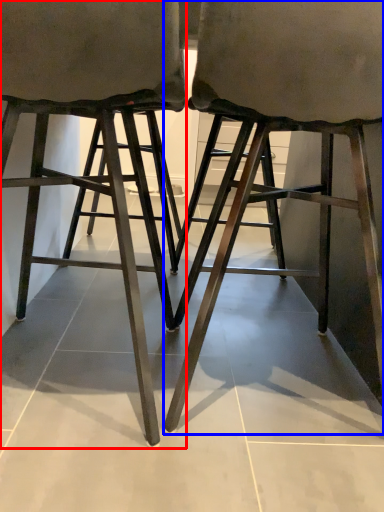
Question: Which object appears farthest to the camera in this image, stool (highlighted by a red box) or stool (highlighted by a blue box)?

Choices:
 (A) stool
 (B) stool

Answer: (B)